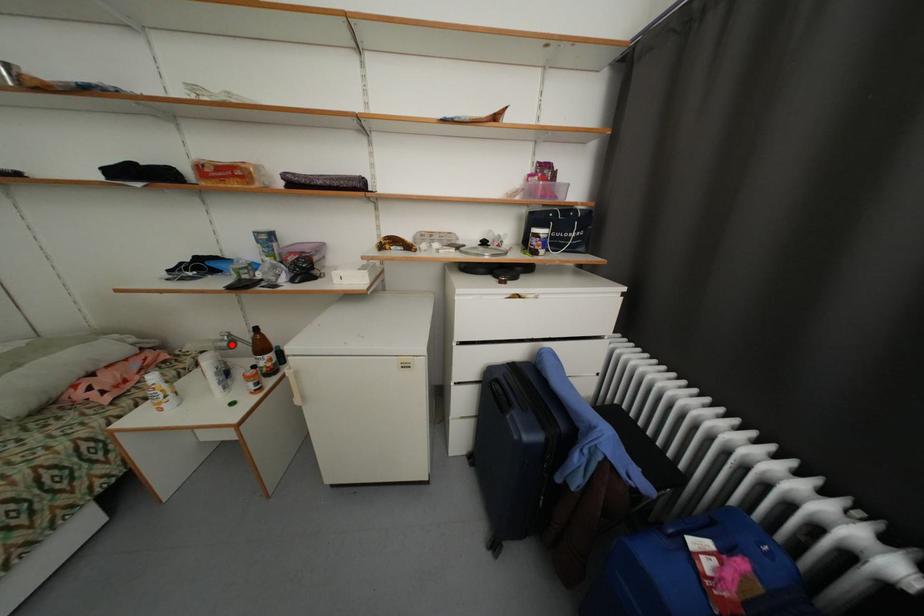
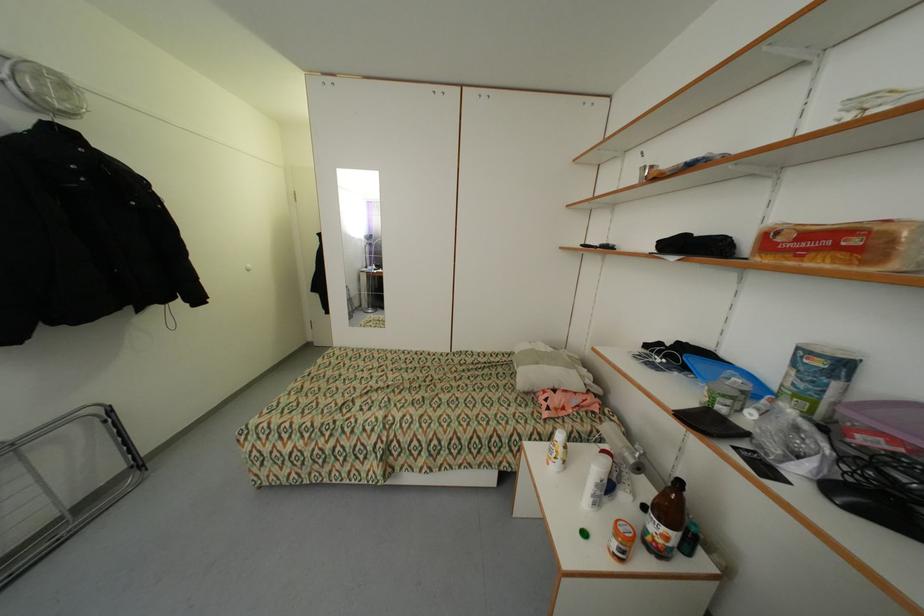
Question: I am providing you with two images of the same scene from different viewpoints. Image1 has a red point marked. In image2, the corresponding 3D location appears at what relative position? Reply with the corresponding letter.

Choices:
 (A) Closer
 (B) Farther

Answer: (A)